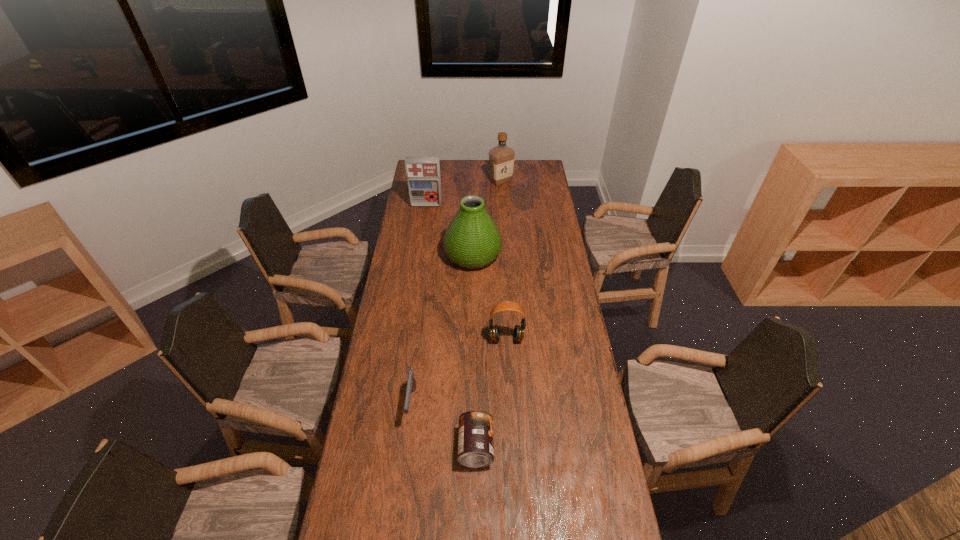
The image size is (960, 540). Identify the location of free space between the fourth tallest object and the third farthest object. 490,297.

At what (x,y) coordinates should I click in order to perform the action: click on free space between the fourth nearest object and the can. Please return your answer as a coordinate pair (x, y). Looking at the image, I should click on (474, 351).

Find the location of a particular element. free space between the pistol and the nearest object is located at coordinates (444, 425).

Locate an element on the screen. The image size is (960, 540). object that is the second closest to the vase is located at coordinates (518, 334).

Point out which object is positioned as the nearest to the third shortest object. Please provide its 2D coordinates. Your answer should be formatted as a tuple, i.e. [(x, y)], where the tuple contains the x and y coordinates of a point satisfying the conditions above.

[(411, 382)]

Locate an element on the screen. This screenshot has width=960, height=540. free point that satisfies the following two spatial constraints: 1. on the front-facing side of the farthest object; 2. on the front label of the nearest object is located at coordinates (517, 447).

Where is `vacant space that satisfies the following two spatial constraints: 1. on the front-facing side of the first-aid kit; 2. on the left side of the vase`? vacant space that satisfies the following two spatial constraints: 1. on the front-facing side of the first-aid kit; 2. on the left side of the vase is located at coordinates (419, 255).